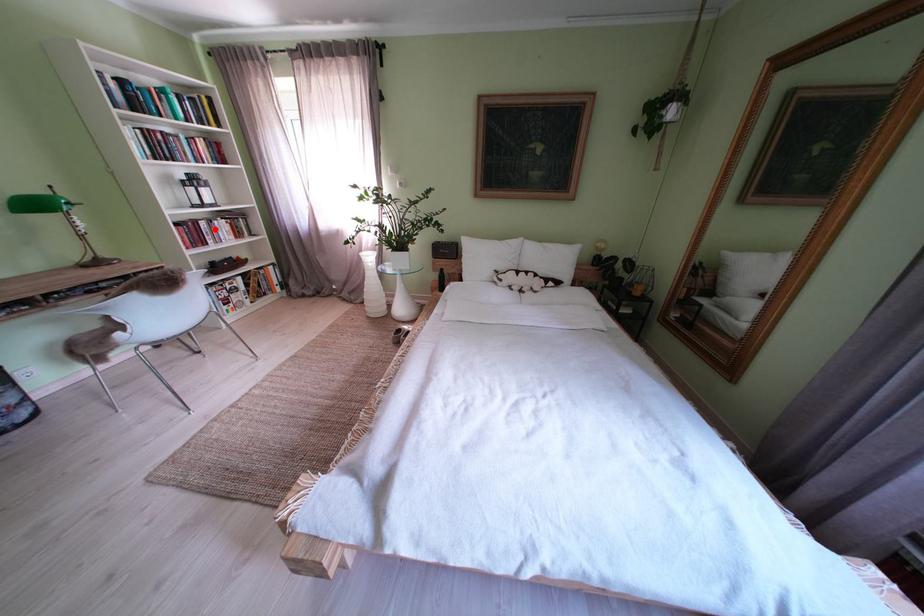
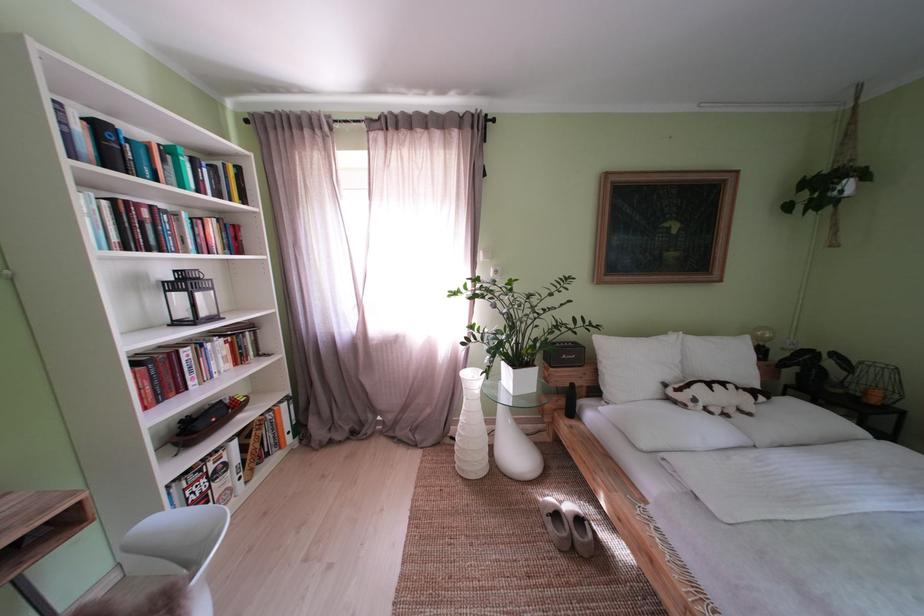
Question: A red point is marked in image1. In image2, is the corresponding 3D point closer to the camera or farther? Reply with the corresponding letter.

Choices:
 (A) The corresponding 3D point is closer.
 (B) The corresponding 3D point is farther.

Answer: (B)